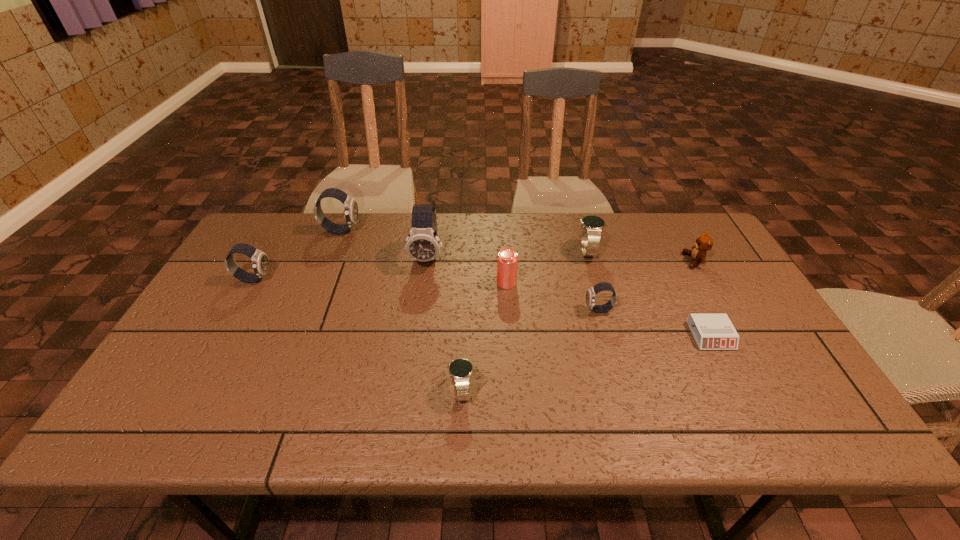
Identify the location of free spot located 0.120m on the front of the fifth object from left to right. (509, 321).

The image size is (960, 540). Find the location of `free space located 0.310m on the front-facing side of the brown teddy bear`. free space located 0.310m on the front-facing side of the brown teddy bear is located at coordinates (583, 261).

Identify the location of vacant space located on the front-facing side of the brown teddy bear. (629, 261).

You are a GUI agent. You are given a task and a screenshot of the screen. Output one action in this format:
    pyautogui.click(x=<x>, y=<y>)
    Task: Click on the vacant space situated 0.350m on the front-facing side of the brown teddy bear
    The height and width of the screenshot is (540, 960).
    Given the screenshot: What is the action you would take?
    pyautogui.click(x=569, y=261)

Locate an element on the screen. blank space located on the face of the third nearest object is located at coordinates (447, 310).

Identify the location of free location located 0.080m on the face of the third nearest object. (555, 310).

At what (x,y) coordinates should I click in order to perform the action: click on free spot located on the face of the third nearest object. Please return your answer as a coordinate pair (x, y). This screenshot has width=960, height=540. Looking at the image, I should click on (492, 310).

This screenshot has height=540, width=960. Find the location of `free location located on the back of the nearer blue watch`. free location located on the back of the nearer blue watch is located at coordinates (466, 291).

Find the location of a particular element. Image resolution: width=960 pixels, height=540 pixels. blank space located on the front of the eighth farthest object is located at coordinates (739, 393).

I want to click on teddy bear that is at the far edge, so click(x=704, y=243).